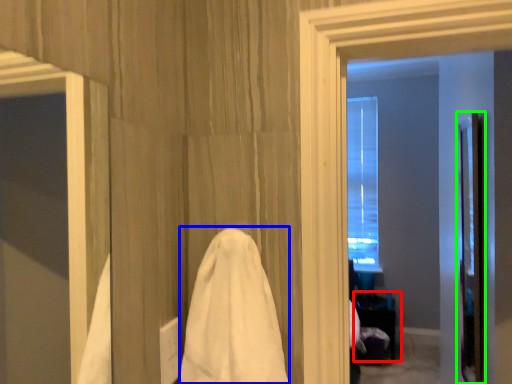
Question: Which is farther away from table (highlighted by a red box)? bath towel (highlighted by a blue box) or screen door (highlighted by a green box)?

Choices:
 (A) bath towel
 (B) screen door

Answer: (A)